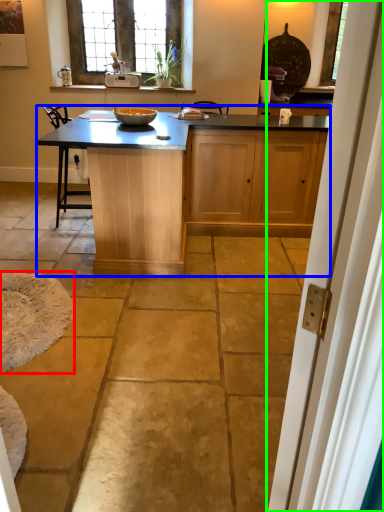
Question: Which is nearer to the wide (highlighted by a red box)? kitchen & dining room table (highlighted by a blue box) or screen door (highlighted by a green box).

Choices:
 (A) kitchen & dining room table
 (B) screen door

Answer: (A)